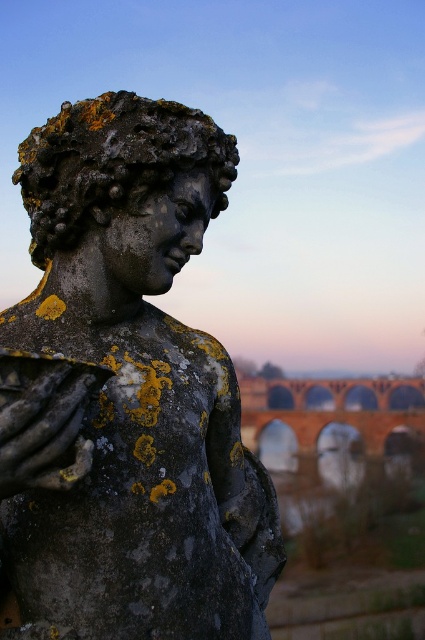
Question: Is rusty stone statue at upper left thinner than brick/stone arches at center?

Choices:
 (A) no
 (B) yes

Answer: (B)

Question: Can you confirm if rusty stone statue at upper left is positioned to the left of brick/stone arches at center?

Choices:
 (A) yes
 (B) no

Answer: (A)

Question: Which object appears closest to the camera in this image?

Choices:
 (A) rusty stone statue at upper left
 (B) brick/stone arches at center

Answer: (A)

Question: Is rusty stone statue at upper left bigger than brick/stone arches at center?

Choices:
 (A) no
 (B) yes

Answer: (B)